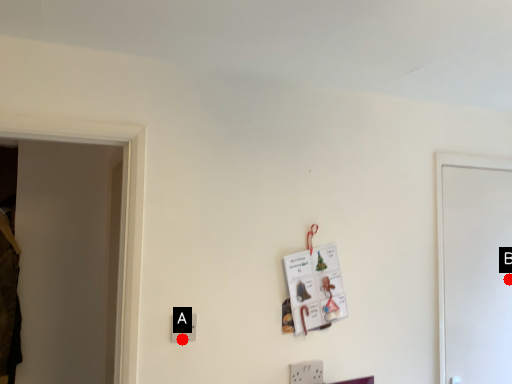
Question: Two points are circled on the image, labeled by A and B beside each circle. Which point is closer to the camera taking this photo?

Choices:
 (A) A is closer
 (B) B is closer

Answer: (A)